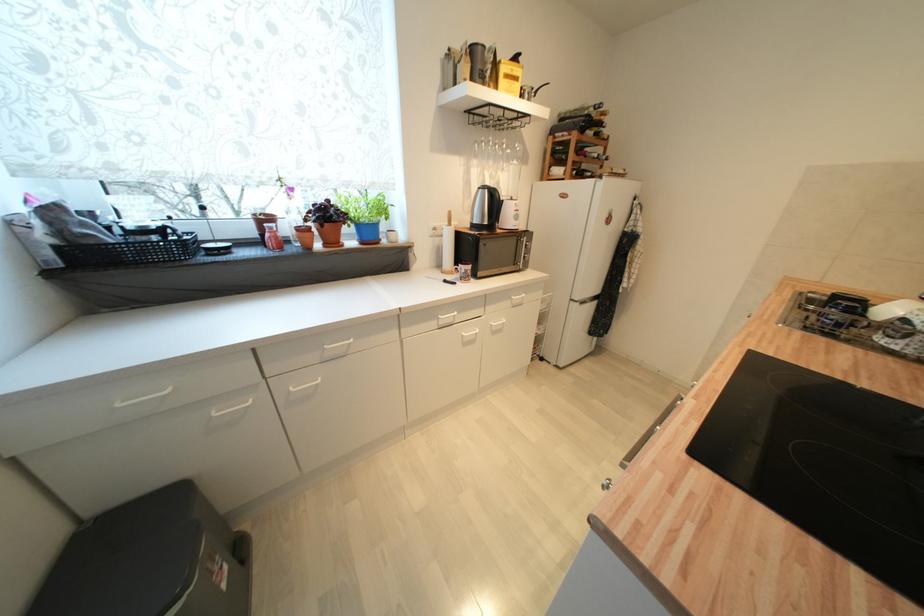
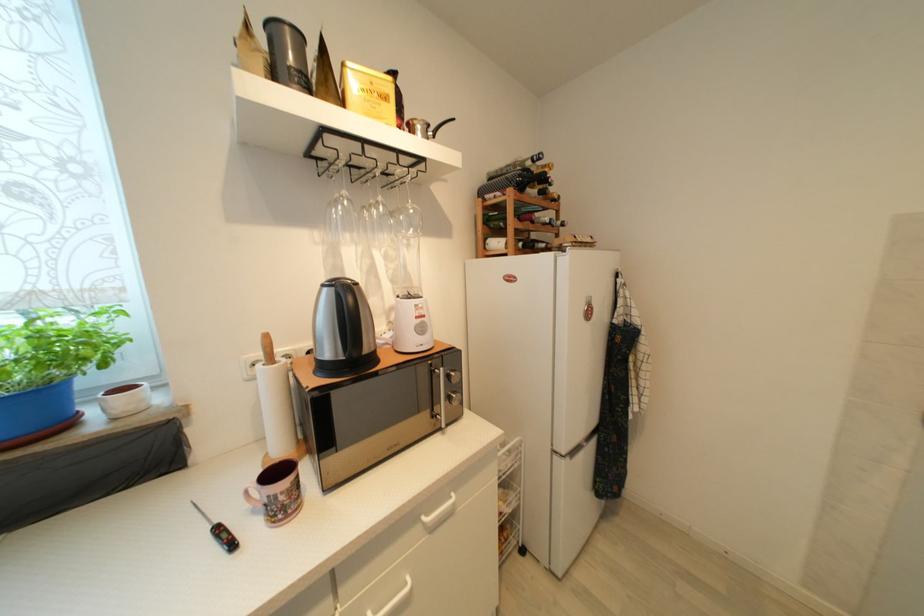
Locate, in the second image, the point that corresponds to the point at 529,257 in the first image.

(455, 400)